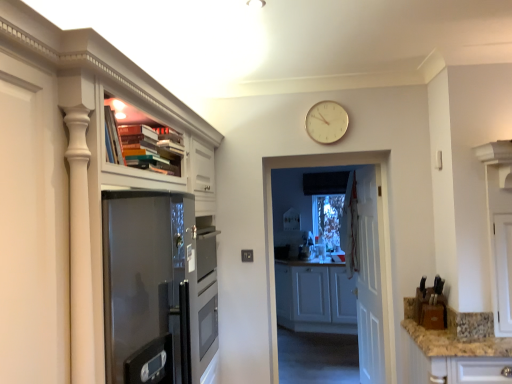
Question: From a real-world perspective, is white glossy door at center positioned above or below granite countertop at lower right?

Choices:
 (A) below
 (B) above

Answer: (B)

Question: From the image's perspective, is white glossy door at center above or below granite countertop at lower right?

Choices:
 (A) below
 (B) above

Answer: (B)

Question: Estimate the real-world distances between objects in this image. Which object is closer to the gold metallic clock at upper center?

Choices:
 (A) white wooden door at center
 (B) white glossy door at center
 (C) granite countertop at lower right
 (D) white matte cabinet at center, the first cabinetry positioned from the back
 (E) granite countertop at lower right

Answer: (B)

Question: Considering the real-world distances, which object is farthest from the granite countertop at lower right?

Choices:
 (A) gold metallic clock at upper center
 (B) white matte cabinet at center, which is the second cabinetry from front to back
 (C) white glossy door at center
 (D) white wooden door at center
 (E) matte white cabinet at upper left, the 1th cabinetry from the left

Answer: (B)